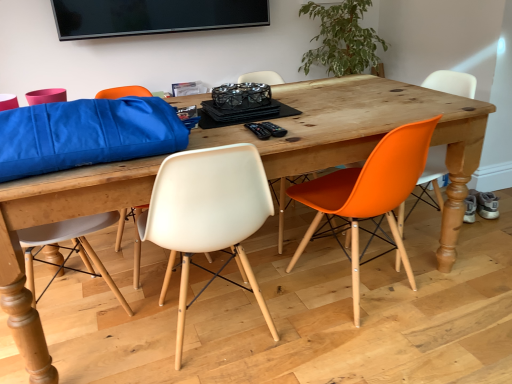
Describe the element at coordinates (369, 196) in the screenshot. Image resolution: width=512 pixels, height=384 pixels. I see `orange matte plastic chair at right, which appears as the 2th chair when viewed from the right` at that location.

How much space does black plastic remote control at center, which is the 2th remote control in right-to-left order, occupy horizontally?

The width of black plastic remote control at center, which is the 2th remote control in right-to-left order, is 6.74 inches.

At what (x,y) coordinates should I click in order to perform the action: click on black plastic remote control at center, which is the 2th remote control in right-to-left order. Please return your answer as a coordinate pair (x, y). Looking at the image, I should click on (259, 130).

Where is `white plastic chair at center, which is the 3th chair from right to left`? white plastic chair at center, which is the 3th chair from right to left is located at coordinates (207, 214).

The height and width of the screenshot is (384, 512). I want to click on orange matte plastic chair at right, which is counted as the second chair, starting from the left, so click(x=369, y=196).

Can you tell me how much black plastic remote control at center, which is the 2th remote control in right-to-left order, and white plastic chair at center, positioned as the first chair in left-to-right order, differ in facing direction?

The angle between the facing direction of black plastic remote control at center, which is the 2th remote control in right-to-left order, and the facing direction of white plastic chair at center, positioned as the first chair in left-to-right order, is 179 degrees.

Would you consider black plastic remote control at center, which is the 2th remote control in right-to-left order, to be distant from white plastic chair at center, which is the 3th chair from right to left?

No.

From the image's perspective, which is below, black plastic remote control at center, which is the 2th remote control in right-to-left order, or white plastic chair at center, which is the 3th chair from right to left?

white plastic chair at center, which is the 3th chair from right to left, from the image's perspective.

Who is shorter, white plastic chair at center, which is the 3th chair from right to left, or orange matte plastic chair at right, which appears as the 2th chair when viewed from the right?

With less height is orange matte plastic chair at right, which appears as the 2th chair when viewed from the right.

From a real-world perspective, is white plastic chair at center, which is the 3th chair from right to left, physically below orange matte plastic chair at right, which appears as the 2th chair when viewed from the right?

Actually, white plastic chair at center, which is the 3th chair from right to left, is physically above orange matte plastic chair at right, which appears as the 2th chair when viewed from the right, in the real world.

Relative to orange matte plastic chair at right, which is counted as the second chair, starting from the left, is white plastic chair at center, which is the 3th chair from right to left, in front or behind?

Clearly, white plastic chair at center, which is the 3th chair from right to left, is in front of orange matte plastic chair at right, which is counted as the second chair, starting from the left.

Is orange matte plastic chair at right, which appears as the 2th chair when viewed from the right, at the back of white plastic chair at center, which is the 3th chair from right to left?

No, orange matte plastic chair at right, which appears as the 2th chair when viewed from the right, is not at the back of white plastic chair at center, which is the 3th chair from right to left.

Is orange plastic chair at right, the 1th chair positioned from the right, oriented towards white plastic chair at center, which is the 3th chair from right to left?

Yes, orange plastic chair at right, the 1th chair positioned from the right, is aimed at white plastic chair at center, which is the 3th chair from right to left.

From a real-world perspective, is orange plastic chair at right, the third chair positioned from the left, physically located above or below white plastic chair at center, which is the 3th chair from right to left?

orange plastic chair at right, the third chair positioned from the left, is situated lower than white plastic chair at center, which is the 3th chair from right to left, in the real world.

Can you confirm if orange plastic chair at right, the third chair positioned from the left, is thinner than white plastic chair at center, positioned as the first chair in left-to-right order?

Yes, orange plastic chair at right, the third chair positioned from the left, is thinner than white plastic chair at center, positioned as the first chair in left-to-right order.

Consider the image. From their relative heights in the image, would you say orange plastic chair at right, the 1th chair positioned from the right, is taller or shorter than white plastic chair at center, which is the 3th chair from right to left?

Clearly, orange plastic chair at right, the 1th chair positioned from the right, is taller compared to white plastic chair at center, which is the 3th chair from right to left.

Looking at their sizes, would you say orange matte plastic chair at right, which is counted as the second chair, starting from the left, is wider or thinner than white plastic chair at center, positioned as the first chair in left-to-right order?

Considering their sizes, orange matte plastic chair at right, which is counted as the second chair, starting from the left, looks broader than white plastic chair at center, positioned as the first chair in left-to-right order.

Which is more to the right, orange matte plastic chair at right, which appears as the 2th chair when viewed from the right, or white plastic chair at center, positioned as the first chair in left-to-right order?

From the viewer's perspective, orange matte plastic chair at right, which appears as the 2th chair when viewed from the right, appears more on the right side.

In the image, is orange matte plastic chair at right, which appears as the 2th chair when viewed from the right, positioned in front of or behind white plastic chair at center, positioned as the first chair in left-to-right order?

orange matte plastic chair at right, which appears as the 2th chair when viewed from the right, is positioned farther from the viewer than white plastic chair at center, positioned as the first chair in left-to-right order.

Are white plastic chair at center, positioned as the first chair in left-to-right order, and black plastic remote control at center, which is the second remote control from left to right, making contact?

No, white plastic chair at center, positioned as the first chair in left-to-right order, is not with black plastic remote control at center, which is the second remote control from left to right.

Is white plastic chair at center, positioned as the first chair in left-to-right order, smaller than black plastic remote control at center, the 1th remote control viewed from the right?

Incorrect, white plastic chair at center, positioned as the first chair in left-to-right order, is not smaller in size than black plastic remote control at center, the 1th remote control viewed from the right.

From a real-world perspective, which is physically below, white plastic chair at center, which is the 3th chair from right to left, or black plastic remote control at center, the 1th remote control viewed from the right?

From a 3D spatial view, white plastic chair at center, which is the 3th chair from right to left, is below.

The height and width of the screenshot is (384, 512). I want to click on remote control that appears on the right of black plastic remote control at center, which is counted as the first remote control, starting from the left, so [x=273, y=129].

Considering the relative positions of black plastic remote control at center, which is the second remote control from left to right, and black plastic remote control at center, which is counted as the first remote control, starting from the left, in the image provided, is black plastic remote control at center, which is the second remote control from left to right, to the right of black plastic remote control at center, which is counted as the first remote control, starting from the left, from the viewer's perspective?

Correct, you'll find black plastic remote control at center, which is the second remote control from left to right, to the right of black plastic remote control at center, which is counted as the first remote control, starting from the left.

Is black plastic remote control at center, which is the second remote control from left to right, in contact with black plastic remote control at center, which is counted as the first remote control, starting from the left?

Yes, black plastic remote control at center, which is the second remote control from left to right, and black plastic remote control at center, which is counted as the first remote control, starting from the left, clearly make contact.

Between point (272, 130) and point (247, 123), which one is positioned in front?

The point (272, 130) is closer.

Considering the sizes of black plastic remote control at center, which is the second remote control from left to right, and white plastic chair at center, which is the 3th chair from right to left, in the image, is black plastic remote control at center, which is the second remote control from left to right, wider or thinner than white plastic chair at center, which is the 3th chair from right to left,?

black plastic remote control at center, which is the second remote control from left to right, is thinner than white plastic chair at center, which is the 3th chair from right to left.

This screenshot has height=384, width=512. What are the coordinates of `the 1st chair directly beneath the black plastic remote control at center, which is the second remote control from left to right (from a real-world perspective)` in the screenshot? It's located at (207, 214).

Considering the relative positions of black plastic remote control at center, which is the second remote control from left to right, and white plastic chair at center, positioned as the first chair in left-to-right order, in the image provided, is black plastic remote control at center, which is the second remote control from left to right, to the left of white plastic chair at center, positioned as the first chair in left-to-right order, from the viewer's perspective?

No, black plastic remote control at center, which is the second remote control from left to right, is not to the left of white plastic chair at center, positioned as the first chair in left-to-right order.

You are a GUI agent. You are given a task and a screenshot of the screen. Output one action in this format:
    pyautogui.click(x=<x>, y=<y>)
    Task: Click on the 2nd chair in front when counting from the black plastic remote control at center, which is the 2th remote control in right-to-left order
    This screenshot has width=512, height=384.
    Given the screenshot: What is the action you would take?
    pyautogui.click(x=207, y=214)

From the image's perspective, which chair is the 1st one above the white plastic chair at center, positioned as the first chair in left-to-right order? Please provide its 2D coordinates.

[(369, 196)]

Estimate the real-world distances between objects in this image. Which object is further from orange matte plastic chair at right, which appears as the 2th chair when viewed from the right, black plastic remote control at center, the 1th remote control viewed from the right, or black plastic remote control at center, which is the 2th remote control in right-to-left order?

black plastic remote control at center, which is the 2th remote control in right-to-left order, is further to orange matte plastic chair at right, which appears as the 2th chair when viewed from the right.

From the image, which object appears to be farther from black plastic remote control at center, which is the second remote control from left to right, orange matte plastic chair at right, which appears as the 2th chair when viewed from the right, or black plastic remote control at center, which is counted as the first remote control, starting from the left?

orange matte plastic chair at right, which appears as the 2th chair when viewed from the right, is further to black plastic remote control at center, which is the second remote control from left to right.

Considering their positions, is white plastic chair at center, positioned as the first chair in left-to-right order, positioned closer to black plastic remote control at center, which is the 2th remote control in right-to-left order, than orange matte plastic chair at right, which is counted as the second chair, starting from the left?

white plastic chair at center, positioned as the first chair in left-to-right order.

Which object lies further to the anchor point orange matte plastic chair at right, which appears as the 2th chair when viewed from the right, orange plastic chair at right, the third chair positioned from the left, or black plastic remote control at center, which is counted as the first remote control, starting from the left?

Among the two, orange plastic chair at right, the third chair positioned from the left, is located further to orange matte plastic chair at right, which appears as the 2th chair when viewed from the right.

Based on their spatial positions, is black plastic remote control at center, which is the 2th remote control in right-to-left order, or orange matte plastic chair at right, which is counted as the second chair, starting from the left, further from white plastic chair at center, which is the 3th chair from right to left?

Among the two, orange matte plastic chair at right, which is counted as the second chair, starting from the left, is located further to white plastic chair at center, which is the 3th chair from right to left.

Estimate the real-world distances between objects in this image. Which object is further from white plastic chair at center, which is the 3th chair from right to left, black plastic remote control at center, the 1th remote control viewed from the right, or black plastic remote control at center, which is counted as the first remote control, starting from the left?

black plastic remote control at center, the 1th remote control viewed from the right, is further to white plastic chair at center, which is the 3th chair from right to left.

Which object lies nearer to the anchor point white plastic chair at center, positioned as the first chair in left-to-right order, black plastic remote control at center, which is counted as the first remote control, starting from the left, or orange plastic chair at right, the 1th chair positioned from the right?

black plastic remote control at center, which is counted as the first remote control, starting from the left.

From the image, which object appears to be nearer to black plastic remote control at center, which is the 2th remote control in right-to-left order, orange matte plastic chair at right, which appears as the 2th chair when viewed from the right, or black plastic remote control at center, the 1th remote control viewed from the right?

black plastic remote control at center, the 1th remote control viewed from the right, lies closer to black plastic remote control at center, which is the 2th remote control in right-to-left order, than the other object.

Where is `chair situated between black plastic remote control at center, which is the second remote control from left to right, and orange plastic chair at right, the third chair positioned from the left, from left to right`? The width and height of the screenshot is (512, 384). chair situated between black plastic remote control at center, which is the second remote control from left to right, and orange plastic chair at right, the third chair positioned from the left, from left to right is located at coordinates (369, 196).

The image size is (512, 384). I want to click on chair located between white plastic chair at center, which is the 3th chair from right to left, and orange plastic chair at right, the third chair positioned from the left, in the left-right direction, so click(x=369, y=196).

The height and width of the screenshot is (384, 512). What are the coordinates of `remote control between black plastic remote control at center, which is the 2th remote control in right-to-left order, and orange matte plastic chair at right, which appears as the 2th chair when viewed from the right` in the screenshot? It's located at (273, 129).

The width and height of the screenshot is (512, 384). I want to click on remote control situated between black plastic remote control at center, which is counted as the first remote control, starting from the left, and orange plastic chair at right, the 1th chair positioned from the right, from left to right, so click(x=273, y=129).